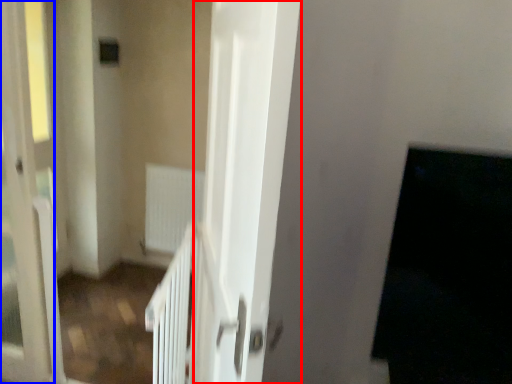
Question: Which of the following is the farthest to the observer, screen door (highlighted by a red box) or screen door (highlighted by a blue box)?

Choices:
 (A) screen door
 (B) screen door

Answer: (B)